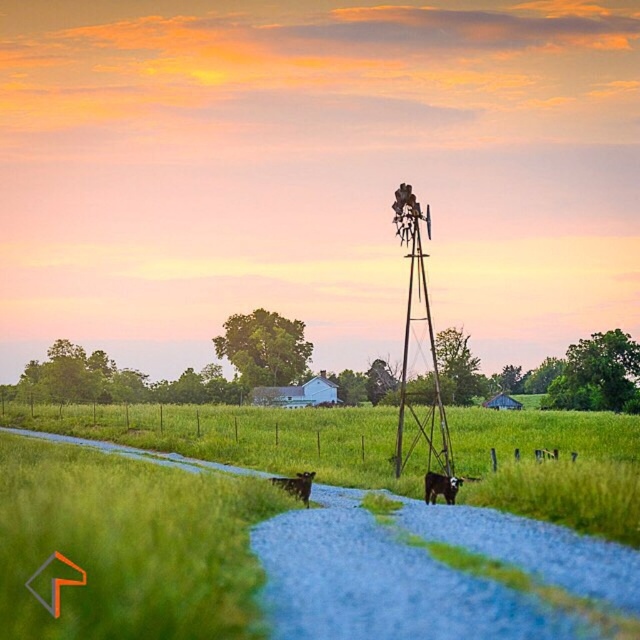
You are a farmer checking the pasture. You notice the green grass at center and the black glossy cow at center. Which one is taller?

The green grass at center is much taller than the black glossy cow at center.

You are a photographer standing at the edge of the gravel road in the rural scene. You want to take a photo that includes both the green grass at center and the black glossy cow at center. Given that your camera has a maximum focus range of 20 meters, will you be able to capture both subjects in focus without moving your position?

The distance between the green grass at center and the black glossy cow at center is 19.78 meters, which is within the camera maximum focus range of 20 meters. Therefore, you can capture both subjects in focus without moving your position.

You are a photographer trying to capture both the rusty metal windmill at center and the brown furry dog at center in a single frame. Which object will appear bigger in your photo?

The rusty metal windmill at center will appear bigger in the photo because it is larger in size than the brown furry dog at center.